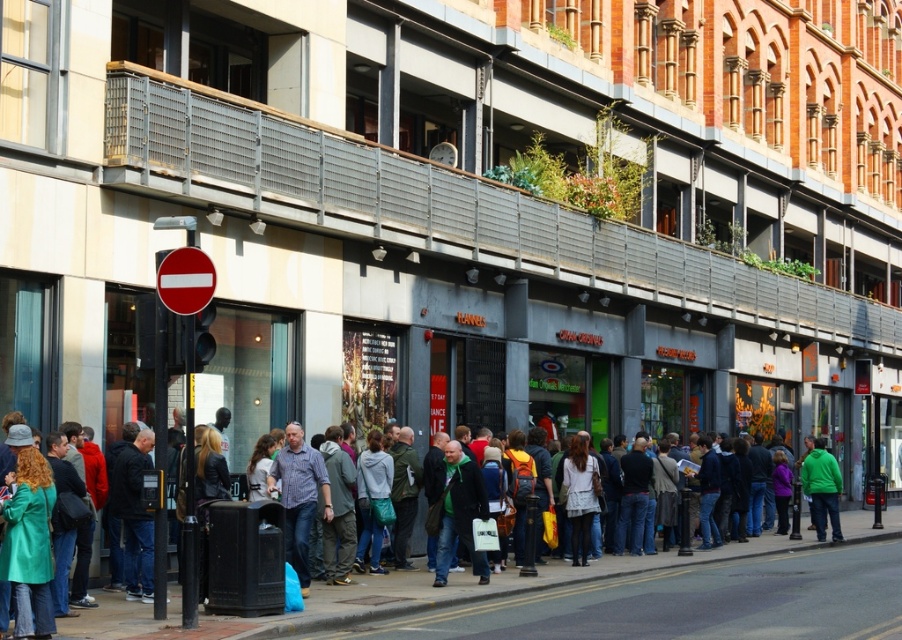
Between concrete sidewalk at lower center and green fleece jacket at center, which one is positioned lower?

concrete sidewalk at lower center is below.

Is concrete sidewalk at lower center smaller than green fleece jacket at center?

Incorrect, concrete sidewalk at lower center is not smaller in size than green fleece jacket at center.

The height and width of the screenshot is (640, 902). What are the coordinates of `concrete sidewalk at lower center` in the screenshot? It's located at (590, 596).

Locate an element on the screen. concrete sidewalk at lower center is located at coordinates (590, 596).

Which is more to the right, green fabric jacket at center or green fleece jacket at center?

green fleece jacket at center

Between green fabric jacket at center and green fleece jacket at center, which one has more height?

Standing taller between the two is green fabric jacket at center.

At what (x,y) coordinates should I click in order to perform the action: click on green fabric jacket at center. Please return your answer as a coordinate pair (x, y). The image size is (902, 640). Looking at the image, I should click on (459, 513).

The image size is (902, 640). I want to click on green fabric jacket at center, so click(x=459, y=513).

The image size is (902, 640). Describe the element at coordinates (299, 497) in the screenshot. I see `blue jeans at center` at that location.

Is blue jeans at center smaller than green fleece jacket at center?

Incorrect, blue jeans at center is not smaller in size than green fleece jacket at center.

This screenshot has height=640, width=902. I want to click on blue jeans at center, so tap(299, 497).